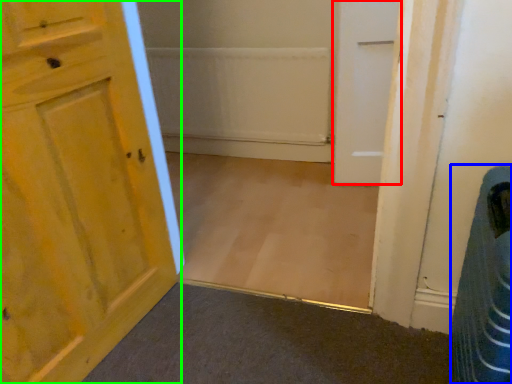
Question: Which object is the farthest from door (highlighted by a red box)? Choose among these: laundry basket (highlighted by a blue box) or door (highlighted by a green box).

Choices:
 (A) laundry basket
 (B) door

Answer: (B)